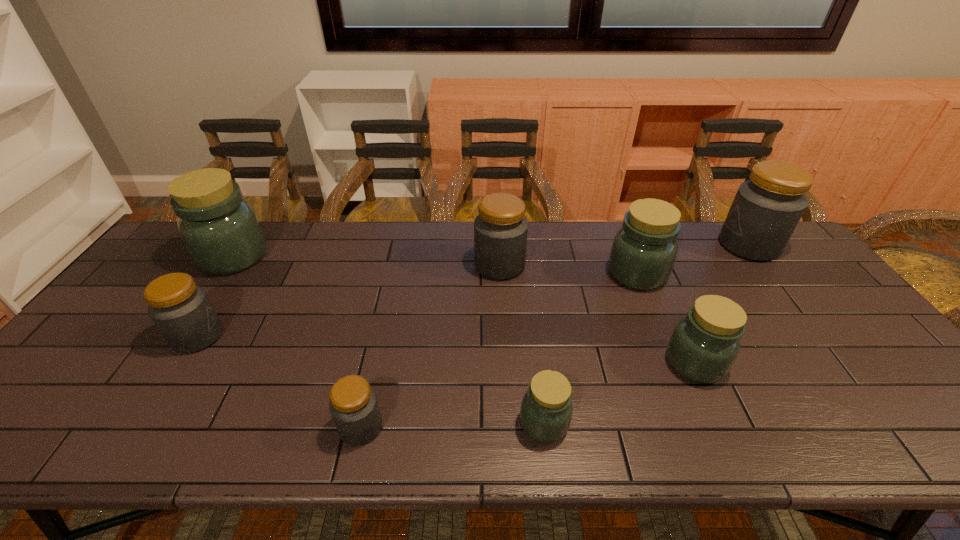
Where is `the rightmost jar`? This screenshot has height=540, width=960. the rightmost jar is located at coordinates (766, 209).

Locate an element on the screen. The image size is (960, 540). the biggest gray jar is located at coordinates (766, 209).

Find the location of a particular element. the biggest green jar is located at coordinates (221, 231).

You are a GUI agent. You are given a task and a screenshot of the screen. Output one action in this format:
    pyautogui.click(x=<x>, y=<y>)
    Task: Click on the third smallest gray jar
    The image size is (960, 540).
    Given the screenshot: What is the action you would take?
    pyautogui.click(x=500, y=230)

Identify the location of the second biggest green jar. (643, 253).

Find the location of a particular element. Image resolution: width=960 pixels, height=540 pixels. the second nearest gray jar is located at coordinates (181, 310).

Find the location of a particular element. the third biggest gray jar is located at coordinates (181, 310).

Identify the location of the second smallest green jar. (704, 345).

Where is `the nearest gray jar`? The height and width of the screenshot is (540, 960). the nearest gray jar is located at coordinates (354, 407).

I want to click on the third gray jar from right to left, so click(354, 407).